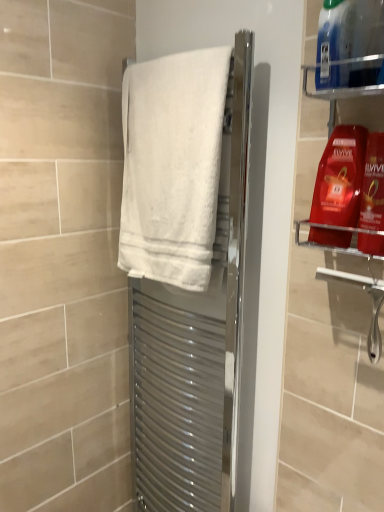
What do you see at coordinates (373, 184) in the screenshot?
I see `shiny red plastic shampoo bottle at upper right, which is counted as the third cleaning product, starting from the top` at bounding box center [373, 184].

The width and height of the screenshot is (384, 512). I want to click on shiny red shampoo at upper right, which appears as the second cleaning product when ordered from the bottom, so click(x=340, y=178).

The height and width of the screenshot is (512, 384). What are the coordinates of `blue plastic bottle at upper right, marked as the 3th cleaning product in a bottom-to-top arrangement` in the screenshot? It's located at (333, 44).

Can white cotton towel at center be found inside shiny red shampoo at upper right, which appears as the second cleaning product when ordered from the bottom?

No, shiny red shampoo at upper right, which appears as the second cleaning product when ordered from the bottom, does not contain white cotton towel at center.

Does shiny red shampoo at upper right, which appears as the second cleaning product when ordered from the bottom, have a smaller size compared to white cotton towel at center?

Correct, shiny red shampoo at upper right, which appears as the second cleaning product when ordered from the bottom, occupies less space than white cotton towel at center.

In the image, is shiny red shampoo at upper right, which appears as the second cleaning product when ordered from the bottom, positioned in front of or behind white cotton towel at center?

shiny red shampoo at upper right, which appears as the second cleaning product when ordered from the bottom, is positioned closer to the viewer than white cotton towel at center.

From a real-world perspective, who is located lower, shiny red shampoo at upper right, which appears as the second cleaning product when viewed from the top, or white cotton towel at center?

shiny red shampoo at upper right, which appears as the second cleaning product when viewed from the top.

Which of these two, white fabric towel at center or shiny red plastic shampoo bottle at upper right, which is counted as the third cleaning product, starting from the top, stands shorter?

shiny red plastic shampoo bottle at upper right, which is counted as the third cleaning product, starting from the top, is shorter.

Considering the sizes of white fabric towel at center and shiny red plastic shampoo bottle at upper right, placed as the first cleaning product when sorted from bottom to top, in the image, is white fabric towel at center wider or thinner than shiny red plastic shampoo bottle at upper right, placed as the first cleaning product when sorted from bottom to top,?

In the image, white fabric towel at center appears to be wider than shiny red plastic shampoo bottle at upper right, placed as the first cleaning product when sorted from bottom to top.

From a real-world perspective, starting from the white fabric towel at center, which cleaning product is the 1st one vertically above it? Please provide its 2D coordinates.

[(373, 184)]

Would you say white fabric towel at center contains shiny red plastic shampoo bottle at upper right, placed as the first cleaning product when sorted from bottom to top?

That's incorrect, shiny red plastic shampoo bottle at upper right, placed as the first cleaning product when sorted from bottom to top, is not inside white fabric towel at center.

Can you confirm if white cotton towel at center is positioned to the left of blue plastic bottle at upper right, marked as the 3th cleaning product in a bottom-to-top arrangement?

Yes, white cotton towel at center is to the left of blue plastic bottle at upper right, marked as the 3th cleaning product in a bottom-to-top arrangement.

How many degrees apart are the facing directions of white cotton towel at center and blue plastic bottle at upper right, marked as the 3th cleaning product in a bottom-to-top arrangement?

white cotton towel at center and blue plastic bottle at upper right, marked as the 3th cleaning product in a bottom-to-top arrangement, are facing 0.561 degrees away from each other.

Considering the positions of objects white cotton towel at center and blue plastic bottle at upper right, marked as the 3th cleaning product in a bottom-to-top arrangement, in the image provided, who is in front, white cotton towel at center or blue plastic bottle at upper right, marked as the 3th cleaning product in a bottom-to-top arrangement,?

blue plastic bottle at upper right, marked as the 3th cleaning product in a bottom-to-top arrangement, is closer to the camera.

From a real-world perspective, which is physically above, white cotton towel at center or shiny red plastic shampoo bottle at upper right, placed as the first cleaning product when sorted from bottom to top?

white cotton towel at center.

Is white cotton towel at center turned away from shiny red plastic shampoo bottle at upper right, placed as the first cleaning product when sorted from bottom to top?

No, white cotton towel at center's orientation is not away from shiny red plastic shampoo bottle at upper right, placed as the first cleaning product when sorted from bottom to top.

Between point (204, 161) and point (378, 182), which one is positioned behind?

The point (204, 161) is farther.

Does white cotton towel at center appear on the left side of shiny red plastic shampoo bottle at upper right, placed as the first cleaning product when sorted from bottom to top?

Indeed, white cotton towel at center is positioned on the left side of shiny red plastic shampoo bottle at upper right, placed as the first cleaning product when sorted from bottom to top.

Is point (362, 222) closer or farther from the camera than point (336, 82)?

Point (362, 222) is positioned farther from the camera compared to point (336, 82).

From a real-world perspective, is shiny red plastic shampoo bottle at upper right, which is counted as the third cleaning product, starting from the top, positioned under blue plastic bottle at upper right, marked as the 3th cleaning product in a bottom-to-top arrangement, based on gravity?

Indeed, from a real-world perspective, shiny red plastic shampoo bottle at upper right, which is counted as the third cleaning product, starting from the top, is positioned beneath blue plastic bottle at upper right, marked as the 3th cleaning product in a bottom-to-top arrangement.

Which of these two, shiny red plastic shampoo bottle at upper right, placed as the first cleaning product when sorted from bottom to top, or blue plastic bottle at upper right, marked as the first cleaning product in a top-to-bottom arrangement, is smaller?

blue plastic bottle at upper right, marked as the first cleaning product in a top-to-bottom arrangement, is smaller.

Is shiny red plastic shampoo bottle at upper right, which is counted as the third cleaning product, starting from the top, placed right next to white fabric towel at center?

They are not placed beside each other.

Where is `screen door behind the shiny red plastic shampoo bottle at upper right, which is counted as the third cleaning product, starting from the top`? The height and width of the screenshot is (512, 384). screen door behind the shiny red plastic shampoo bottle at upper right, which is counted as the third cleaning product, starting from the top is located at coordinates (195, 344).

Can you tell me how much shiny red plastic shampoo bottle at upper right, which is counted as the third cleaning product, starting from the top, and white fabric towel at center differ in facing direction?

The angular difference between shiny red plastic shampoo bottle at upper right, which is counted as the third cleaning product, starting from the top, and white fabric towel at center is 0.562 degrees.

Measure the distance between shiny red plastic shampoo bottle at upper right, placed as the first cleaning product when sorted from bottom to top, and white fabric towel at center.

shiny red plastic shampoo bottle at upper right, placed as the first cleaning product when sorted from bottom to top, and white fabric towel at center are 28.03 inches apart.

Is shiny red plastic shampoo bottle at upper right, placed as the first cleaning product when sorted from bottom to top, in contact with white cotton towel at center?

shiny red plastic shampoo bottle at upper right, placed as the first cleaning product when sorted from bottom to top, is not next to white cotton towel at center, and they're not touching.

Considering the relative positions of shiny red plastic shampoo bottle at upper right, which is counted as the third cleaning product, starting from the top, and white cotton towel at center in the image provided, is shiny red plastic shampoo bottle at upper right, which is counted as the third cleaning product, starting from the top, to the left or to the right of white cotton towel at center?

Clearly, shiny red plastic shampoo bottle at upper right, which is counted as the third cleaning product, starting from the top, is on the right of white cotton towel at center in the image.

How many degrees apart are the facing directions of shiny red plastic shampoo bottle at upper right, which is counted as the third cleaning product, starting from the top, and white cotton towel at center?

0.562 degrees separate the facing orientations of shiny red plastic shampoo bottle at upper right, which is counted as the third cleaning product, starting from the top, and white cotton towel at center.

What are the coordinates of `towel that appears above the shiny red shampoo at upper right, which appears as the second cleaning product when ordered from the bottom (from a real-world perspective)` in the screenshot? It's located at (172, 166).

Locate an element on the screen. The width and height of the screenshot is (384, 512). screen door below the shiny red plastic shampoo bottle at upper right, which is counted as the third cleaning product, starting from the top (from the image's perspective) is located at coordinates (195, 344).

Which object lies nearer to the anchor point shiny red plastic shampoo bottle at upper right, placed as the first cleaning product when sorted from bottom to top, shiny red shampoo at upper right, which appears as the second cleaning product when ordered from the bottom, or white fabric towel at center?

shiny red shampoo at upper right, which appears as the second cleaning product when ordered from the bottom, is closer to shiny red plastic shampoo bottle at upper right, placed as the first cleaning product when sorted from bottom to top.

Which object lies further to the anchor point white fabric towel at center, shiny red plastic shampoo bottle at upper right, placed as the first cleaning product when sorted from bottom to top, or shiny red shampoo at upper right, which appears as the second cleaning product when viewed from the top?

shiny red plastic shampoo bottle at upper right, placed as the first cleaning product when sorted from bottom to top, lies further to white fabric towel at center than the other object.

Based on their spatial positions, is shiny red plastic shampoo bottle at upper right, placed as the first cleaning product when sorted from bottom to top, or blue plastic bottle at upper right, marked as the first cleaning product in a top-to-bottom arrangement, closer to white fabric towel at center?

shiny red plastic shampoo bottle at upper right, placed as the first cleaning product when sorted from bottom to top, is positioned closer to the anchor white fabric towel at center.

Considering their positions, is white fabric towel at center positioned further to shiny red plastic shampoo bottle at upper right, placed as the first cleaning product when sorted from bottom to top, than white cotton towel at center?

Based on the image, white fabric towel at center appears to be further to shiny red plastic shampoo bottle at upper right, placed as the first cleaning product when sorted from bottom to top.

Which object lies further to the anchor point white cotton towel at center, shiny red shampoo at upper right, which appears as the second cleaning product when viewed from the top, or blue plastic bottle at upper right, marked as the 3th cleaning product in a bottom-to-top arrangement?

blue plastic bottle at upper right, marked as the 3th cleaning product in a bottom-to-top arrangement, is positioned further to the anchor white cotton towel at center.

Considering their positions, is shiny red shampoo at upper right, which appears as the second cleaning product when ordered from the bottom, positioned further to blue plastic bottle at upper right, marked as the 3th cleaning product in a bottom-to-top arrangement, than white cotton towel at center?

Among the two, white cotton towel at center is located further to blue plastic bottle at upper right, marked as the 3th cleaning product in a bottom-to-top arrangement.

In the scene shown: Looking at the image, which one is located closer to white fabric towel at center, shiny red shampoo at upper right, which appears as the second cleaning product when ordered from the bottom, or shiny red plastic shampoo bottle at upper right, which is counted as the third cleaning product, starting from the top?

shiny red shampoo at upper right, which appears as the second cleaning product when ordered from the bottom, lies closer to white fabric towel at center than the other object.

In the scene shown: Considering their positions, is white fabric towel at center positioned further to white cotton towel at center than blue plastic bottle at upper right, marked as the first cleaning product in a top-to-bottom arrangement?

blue plastic bottle at upper right, marked as the first cleaning product in a top-to-bottom arrangement.

Image resolution: width=384 pixels, height=512 pixels. Identify the location of towel between blue plastic bottle at upper right, marked as the 3th cleaning product in a bottom-to-top arrangement, and white fabric towel at center, in the vertical direction. (172, 166).

The image size is (384, 512). Find the location of `cleaning product between blue plastic bottle at upper right, marked as the first cleaning product in a top-to-bottom arrangement, and shiny red plastic shampoo bottle at upper right, which is counted as the third cleaning product, starting from the top, in the vertical direction`. cleaning product between blue plastic bottle at upper right, marked as the first cleaning product in a top-to-bottom arrangement, and shiny red plastic shampoo bottle at upper right, which is counted as the third cleaning product, starting from the top, in the vertical direction is located at coordinates (340, 178).

Image resolution: width=384 pixels, height=512 pixels. I want to click on cleaning product between white cotton towel at center and shiny red shampoo at upper right, which appears as the second cleaning product when ordered from the bottom, so click(x=333, y=44).

At what (x,y) coordinates should I click in order to perform the action: click on cleaning product between shiny red shampoo at upper right, which appears as the second cleaning product when viewed from the top, and white fabric towel at center, in the vertical direction. Please return your answer as a coordinate pair (x, y). The height and width of the screenshot is (512, 384). Looking at the image, I should click on (x=373, y=184).